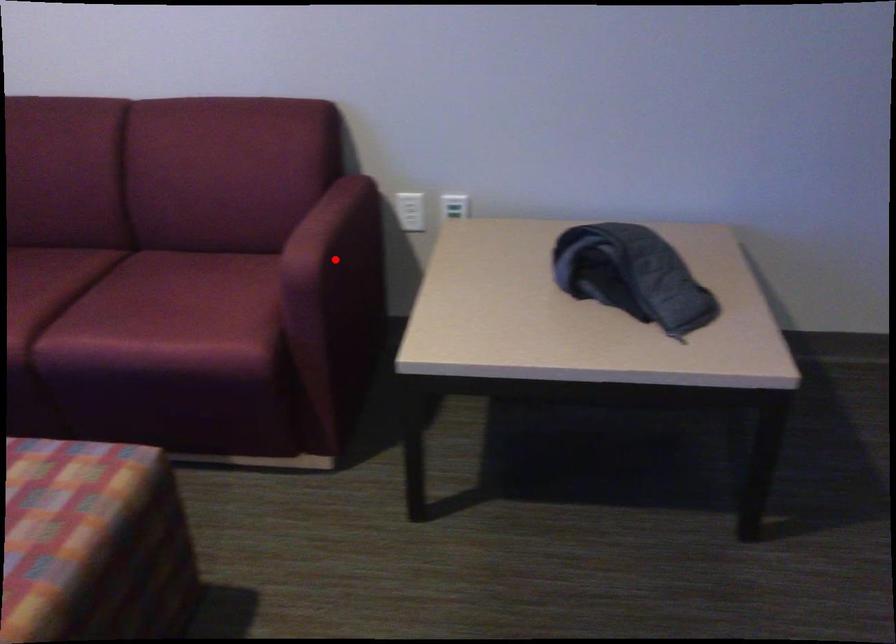
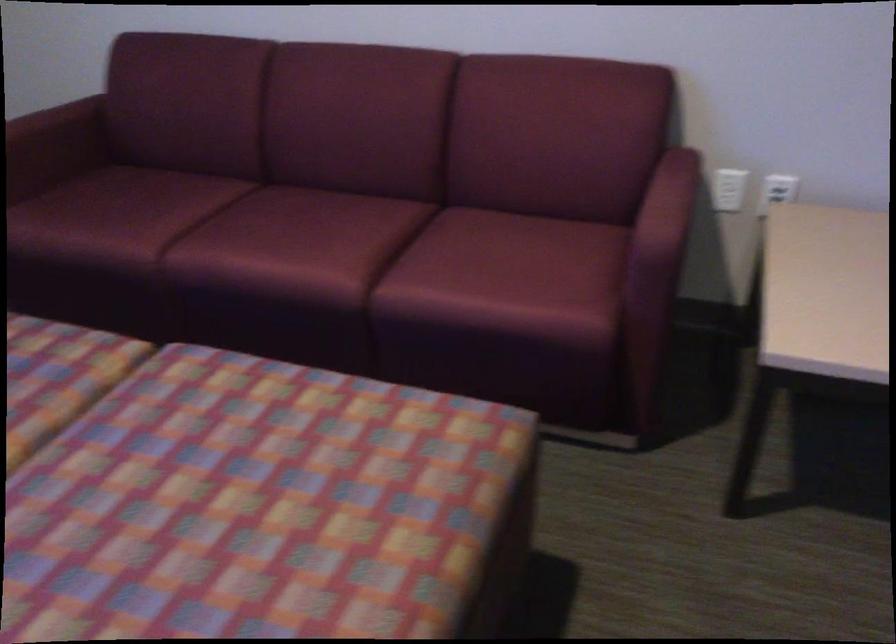
Question: I am providing you with two images of the same scene from different viewpoints. A red point is marked on the first image. At the location where the point appears in image 1, is it still visible in image 2?

Choices:
 (A) Yes
 (B) No

Answer: (B)